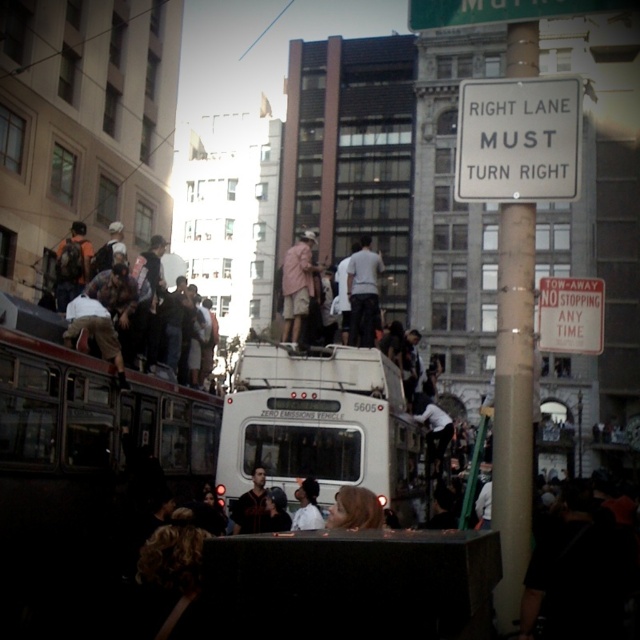
Question: Considering the real-world distances, which object is farthest from the dark hair at center?

Choices:
 (A) white plastic sign at upper center
 (B) blonde hair at center
 (C) red metal tow-away sign at upper right
 (D) white matte pants at center

Answer: (A)

Question: Can you confirm if dark brown leather jacket at center is smaller than white shirt at center?

Choices:
 (A) yes
 (B) no

Answer: (B)

Question: Can you confirm if brown leather backpack at left is positioned to the left of blonde hair at center?

Choices:
 (A) no
 (B) yes

Answer: (B)

Question: Which point appears farthest from the camera in this image?

Choices:
 (A) (97, 259)
 (B) (532, 365)
 (C) (394, 458)

Answer: (A)

Question: Is white plastic sign at upper center wider than blonde hair at center?

Choices:
 (A) yes
 (B) no

Answer: (A)

Question: Which point is farther from the camera taking this photo?

Choices:
 (A) (378, 504)
 (B) (502, 241)
 (C) (282, 512)
 (D) (308, 228)

Answer: (D)